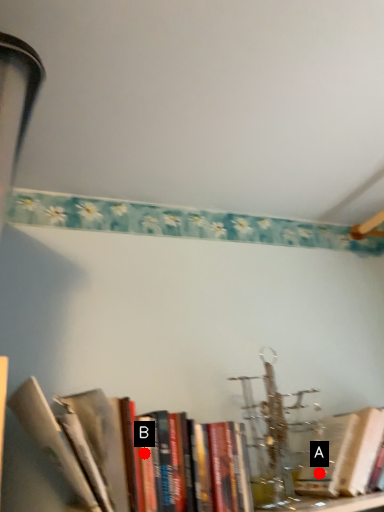
Question: Two points are circled on the image, labeled by A and B beside each circle. Which of the following is the farthest from the observer?

Choices:
 (A) A is further
 (B) B is further

Answer: (A)